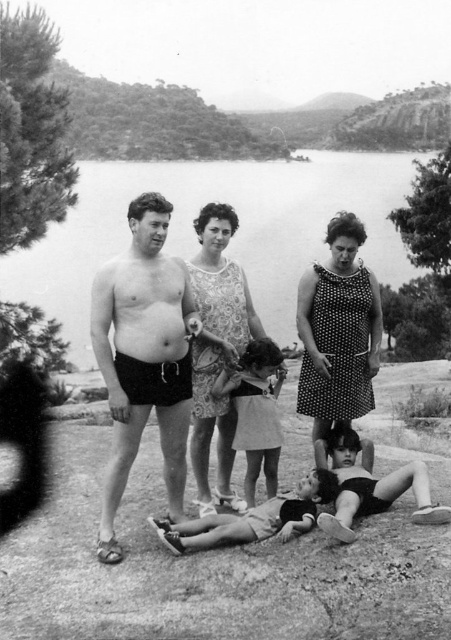
You are standing in the family scene by the water and want to move from the point at coordinates point (208, 497) to the point at coordinates point (111, 392). Which direction should you move to get closer to the water?

You should move towards the point at coordinates point (111, 392) because it is closer to the water than the point at coordinates point (208, 497).

Based on the coordinates provided, which object is located at point (216, 349) in the image?

The point (216, 349) corresponds to the patterned fabric dress at center.

Based on the coordinates provided, where exactly is the matte black shorts at center located in the image?

The matte black shorts at center is located at the coordinates point 0.550 on the x axis and 0.373 on the y axis.